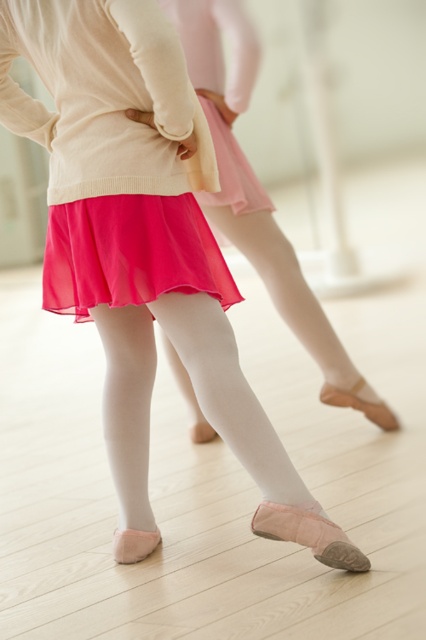
You are a photographer setting up a shoot in the ballet studio. You need to position a light source to the right of the shiny chiffon skirt at center and to the left of the pink satin ballet slipper at lower center. Is this possible based on their current positions?

The shiny chiffon skirt at center is to the left of the pink satin ballet slipper at lower center. Therefore, placing a light source to the right of the shiny chiffon skirt at center and to the left of the pink satin ballet slipper at lower center is possible because the skirt is already positioned to the left of the slipper, allowing space in between for the light source.

You are a costume designer preparing for a ballet performance. You need to ensure that the shiny chiffon skirt at center and the pink satin ballet slipper at lower center are placed correctly in the stage setup. Based on their sizes, which object should be positioned first to accommodate space requirements?

The shiny chiffon skirt at center should be positioned first because its width is larger than the pink satin ballet slipper at lower center, requiring more space.

You are a photographer setting up for a ballet photoshoot. You need to ensure that the pink chiffon skirt at center and the pink satin ballet slipper at lower center are both visible in the frame. Based on their current positions, will the slipper be visible underneath the skirt?

The pink chiffon skirt at center is positioned over the pink satin ballet slipper at lower center, so part of the slipper may be obscured but some portion could still be visible depending on the skirt material and angle.